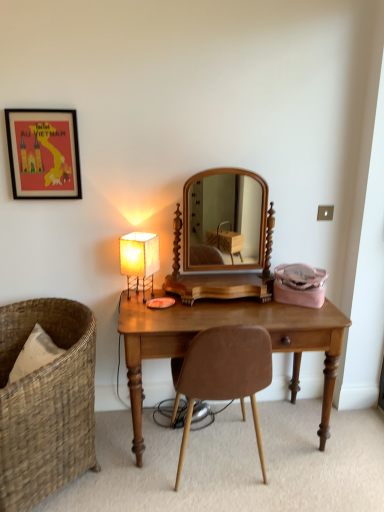
Question: Does woven brown chair at left, the first chair viewed from the left, have a lesser height compared to wooden desk at center?

Choices:
 (A) yes
 (B) no

Answer: (B)

Question: Does woven brown chair at left, the 2th chair in the right-to-left sequence, come in front of wooden desk at center?

Choices:
 (A) no
 (B) yes

Answer: (B)

Question: From a real-world perspective, is woven brown chair at left, the first chair viewed from the left, below wooden desk at center?

Choices:
 (A) no
 (B) yes

Answer: (A)

Question: Is woven brown chair at left, the 2th chair in the right-to-left sequence, wider than wooden desk at center?

Choices:
 (A) yes
 (B) no

Answer: (A)

Question: From the image's perspective, is woven brown chair at left, the 2th chair in the right-to-left sequence, under wooden desk at center?

Choices:
 (A) no
 (B) yes

Answer: (B)

Question: From the image's perspective, is white paper lampshade at left positioned above or below matte black picture frame at upper left?

Choices:
 (A) below
 (B) above

Answer: (A)

Question: Looking at their shapes, would you say white paper lampshade at left is wider or thinner than matte black picture frame at upper left?

Choices:
 (A) thin
 (B) wide

Answer: (B)

Question: Considering the positions of white paper lampshade at left and matte black picture frame at upper left in the image, is white paper lampshade at left taller or shorter than matte black picture frame at upper left?

Choices:
 (A) short
 (B) tall

Answer: (A)

Question: Is white paper lampshade at left inside or outside of matte black picture frame at upper left?

Choices:
 (A) outside
 (B) inside

Answer: (A)

Question: In terms of height, does matte black picture frame at upper left look taller or shorter compared to wooden desk at center?

Choices:
 (A) short
 (B) tall

Answer: (A)

Question: Is point (44, 196) positioned closer to the camera than point (296, 393)?

Choices:
 (A) closer
 (B) farther

Answer: (A)

Question: In terms of width, does matte black picture frame at upper left look wider or thinner when compared to wooden desk at center?

Choices:
 (A) wide
 (B) thin

Answer: (B)

Question: From a real-world perspective, is matte black picture frame at upper left physically located above or below wooden desk at center?

Choices:
 (A) above
 (B) below

Answer: (A)

Question: Is brown leather chair at center, which ranks as the 1th chair in right-to-left order, spatially inside matte black picture frame at upper left, or outside of it?

Choices:
 (A) inside
 (B) outside

Answer: (B)

Question: In terms of width, does brown leather chair at center, which is the second chair in left-to-right order, look wider or thinner when compared to matte black picture frame at upper left?

Choices:
 (A) thin
 (B) wide

Answer: (B)